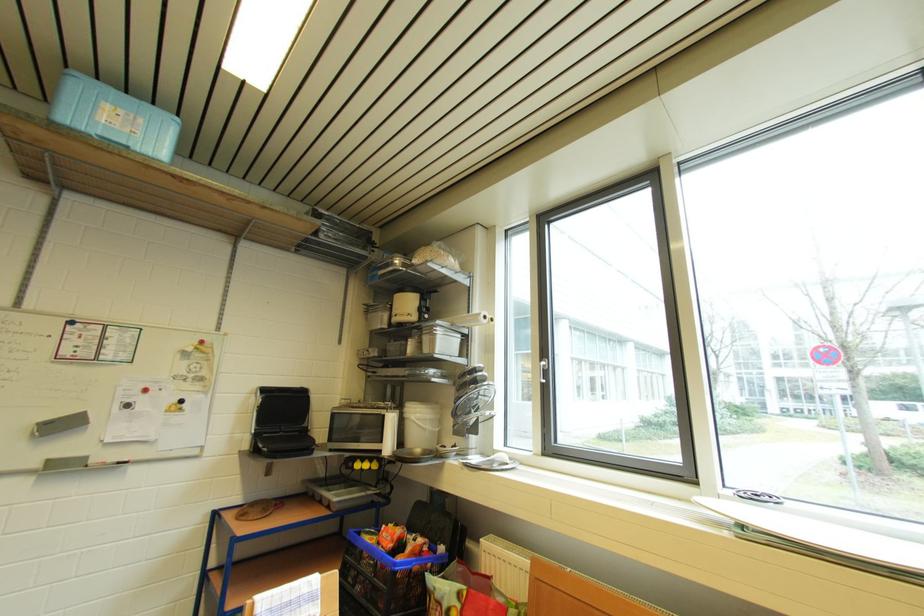
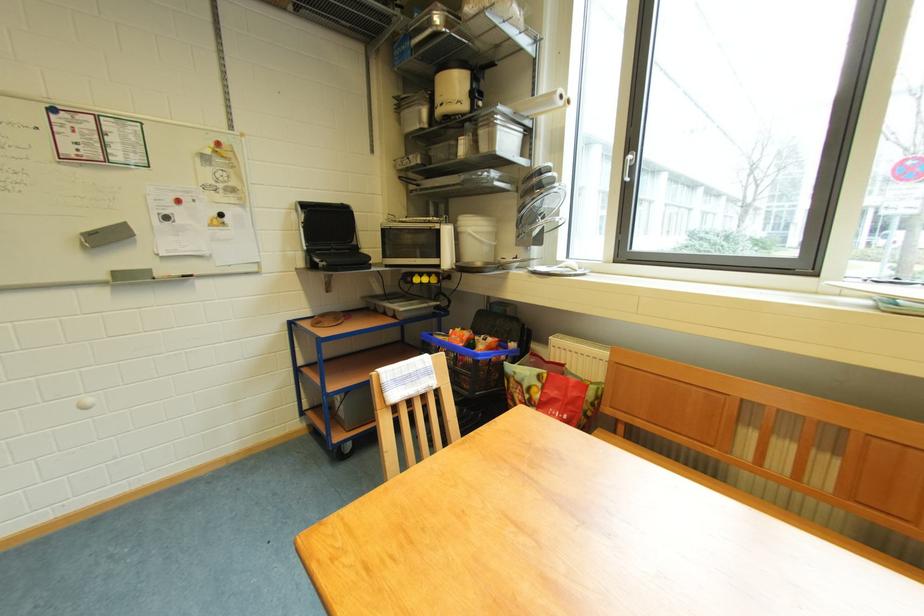
The point at (434, 543) is marked in the first image. Where is the corresponding point in the second image?

(504, 342)